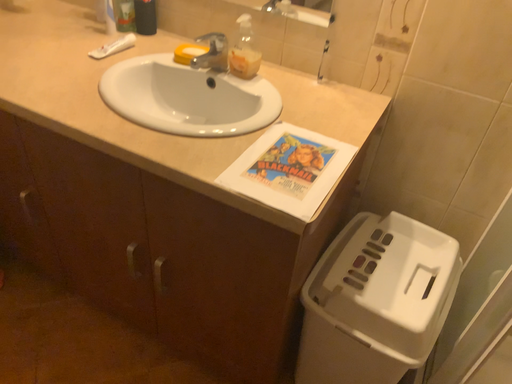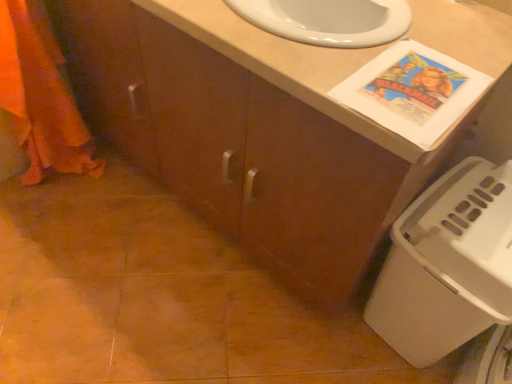
Question: How did the camera likely rotate when shooting the video?

Choices:
 (A) rotated left
 (B) rotated right

Answer: (A)